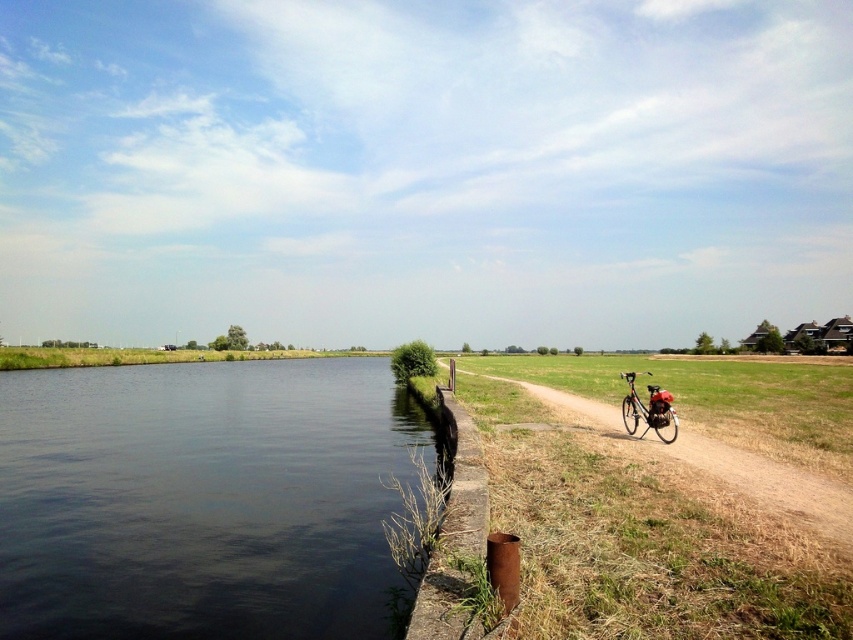
Question: Estimate the real-world distances between objects in this image. Which object is farther from the dark water at center?

Choices:
 (A) brown dirt path at right
 (B) shiny metallic bicycle at right

Answer: (B)

Question: Which of these objects is positioned closest to the dark water at center?

Choices:
 (A) brown dirt path at right
 (B) shiny metallic bicycle at right

Answer: (A)

Question: Can you confirm if dark water at center is positioned to the right of shiny metallic bicycle at right?

Choices:
 (A) no
 (B) yes

Answer: (A)

Question: Is the position of brown dirt path at right more distant than that of shiny metallic bicycle at right?

Choices:
 (A) yes
 (B) no

Answer: (B)

Question: Which object appears closest to the camera in this image?

Choices:
 (A) brown dirt path at right
 (B) dark water at center

Answer: (A)

Question: Is brown dirt path at right thinner than shiny metallic bicycle at right?

Choices:
 (A) yes
 (B) no

Answer: (A)